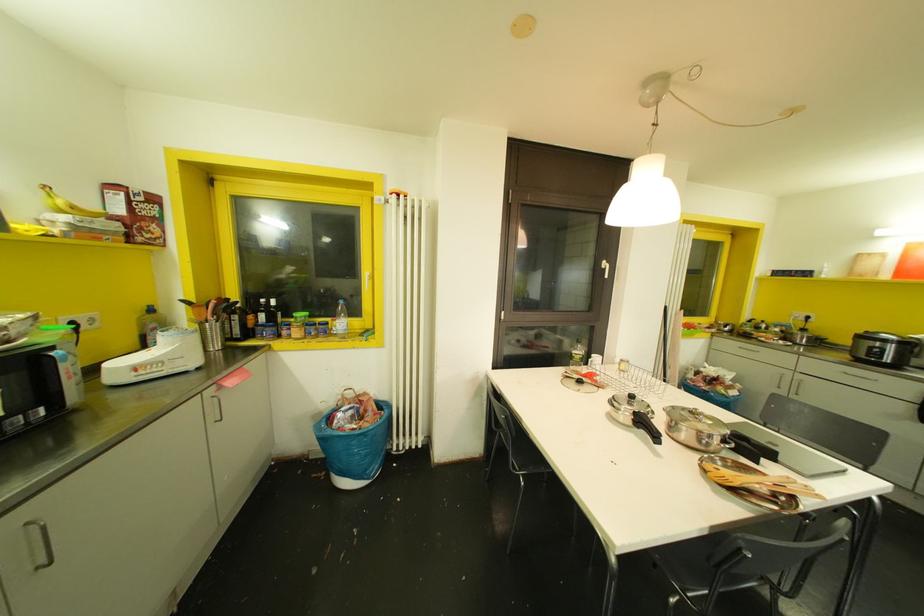
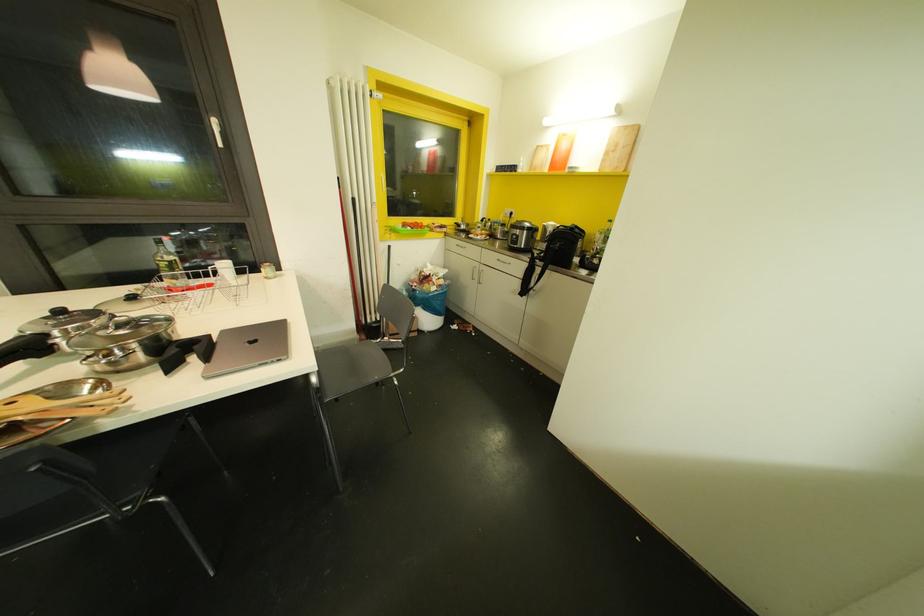
Find the pixel in the second image that matches point 731,344 in the first image.

(453, 243)